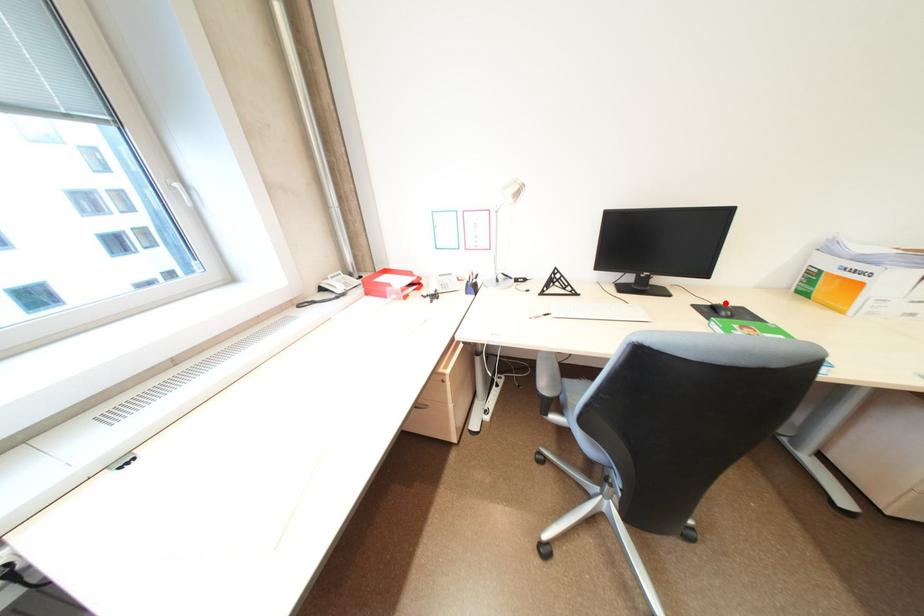
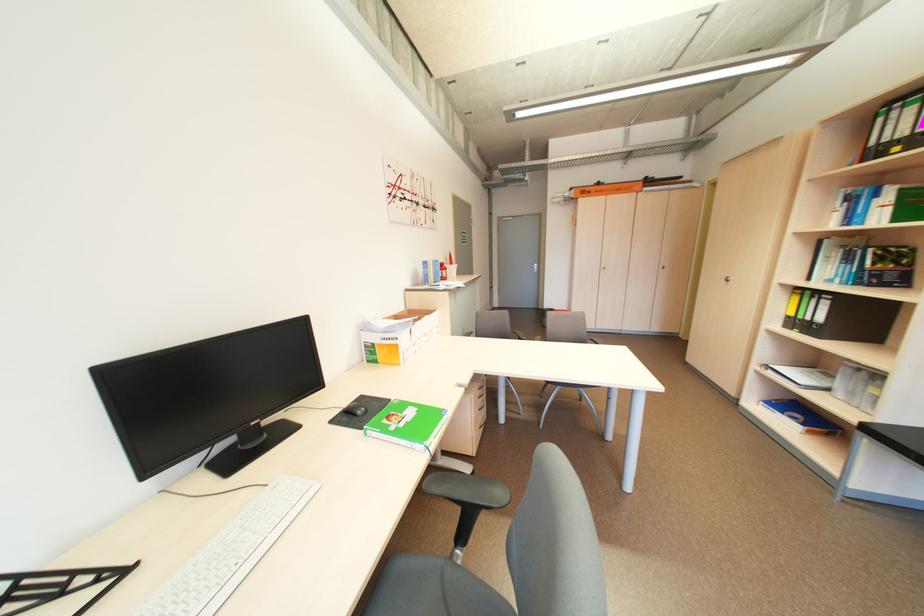
In the second image, find the point that corresponds to the highlighted location in the first image.

(354, 406)